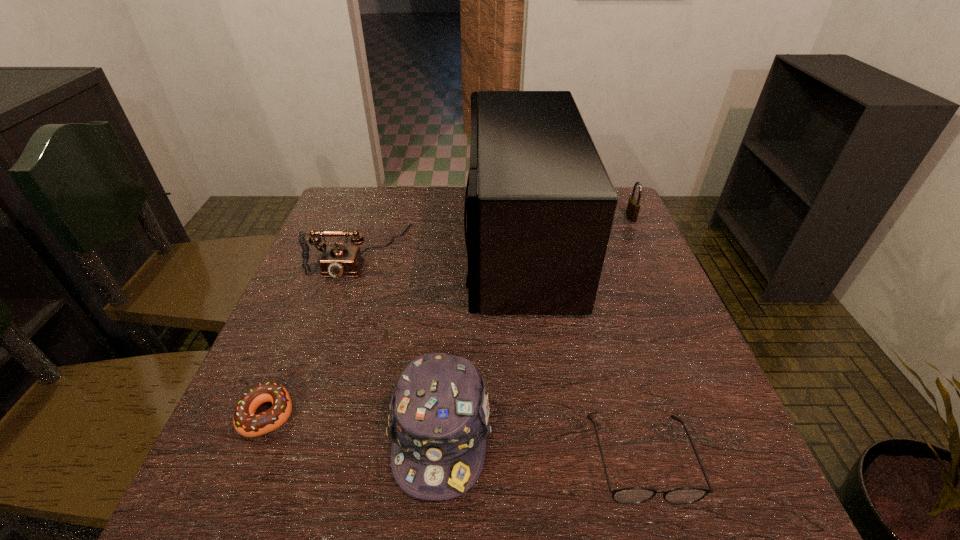
Locate an element on the screen. spectacles that is at the right edge is located at coordinates [633, 495].

Find the location of a particular element. The height and width of the screenshot is (540, 960). object that is at the far left corner is located at coordinates (336, 261).

Where is `object that is positioned at the far right corner`? object that is positioned at the far right corner is located at coordinates (633, 206).

Locate an element on the screen. This screenshot has width=960, height=540. object that is at the near right corner is located at coordinates (633, 495).

In the image, there is a desktop. Where is `vacant space at the far edge`? Image resolution: width=960 pixels, height=540 pixels. vacant space at the far edge is located at coordinates (439, 192).

In the image, there is a desktop. At what (x,y) coordinates should I click in order to perform the action: click on free space at the near edge. Please return your answer as a coordinate pair (x, y). Looking at the image, I should click on (345, 495).

Locate an element on the screen. free space at the left edge of the desktop is located at coordinates pyautogui.click(x=332, y=289).

Identify the location of free space at the right edge of the desktop. (609, 248).

Where is `vacant region at the far left corner of the desktop`? This screenshot has width=960, height=540. vacant region at the far left corner of the desktop is located at coordinates (390, 197).

Image resolution: width=960 pixels, height=540 pixels. I want to click on blank space at the near left corner of the desktop, so pos(254,513).